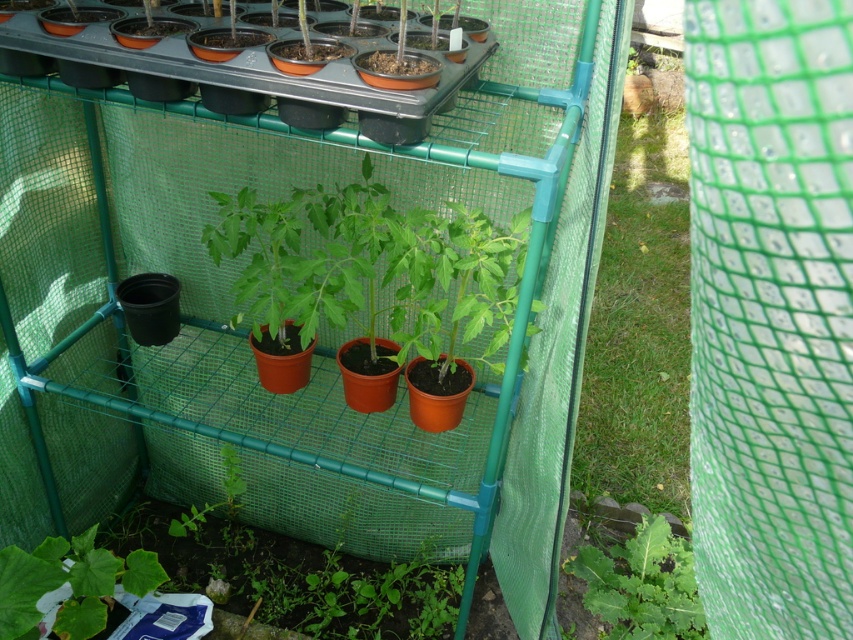
Question: Estimate the real-world distances between objects in this image. Which object is closer to the green mesh at center?

Choices:
 (A) green leafy plant at lower right
 (B) green matte leaf at lower left

Answer: (A)

Question: Does green mesh at center have a larger size compared to green matte leaf at lower left?

Choices:
 (A) no
 (B) yes

Answer: (B)

Question: Can you confirm if green mesh at center is thinner than green leafy plant at lower right?

Choices:
 (A) no
 (B) yes

Answer: (A)

Question: Is green leafy plant at lower right above green matte leaf at lower left?

Choices:
 (A) yes
 (B) no

Answer: (B)

Question: Which object is the closest to the green leafy plant at lower right?

Choices:
 (A) green mesh at center
 (B) green matte leaf at lower left

Answer: (A)

Question: Which point is farther to the camera?

Choices:
 (A) green leafy plant at lower right
 (B) green matte leaf at lower left

Answer: (A)